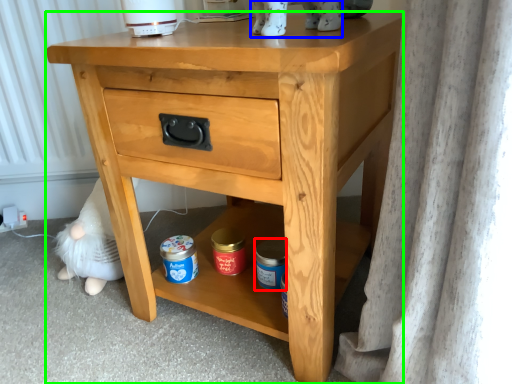
Question: Considering the real-world distances, which object is closest to pottery (highlighted by a red box)? animal (highlighted by a blue box) or nightstand (highlighted by a green box).

Choices:
 (A) animal
 (B) nightstand

Answer: (B)